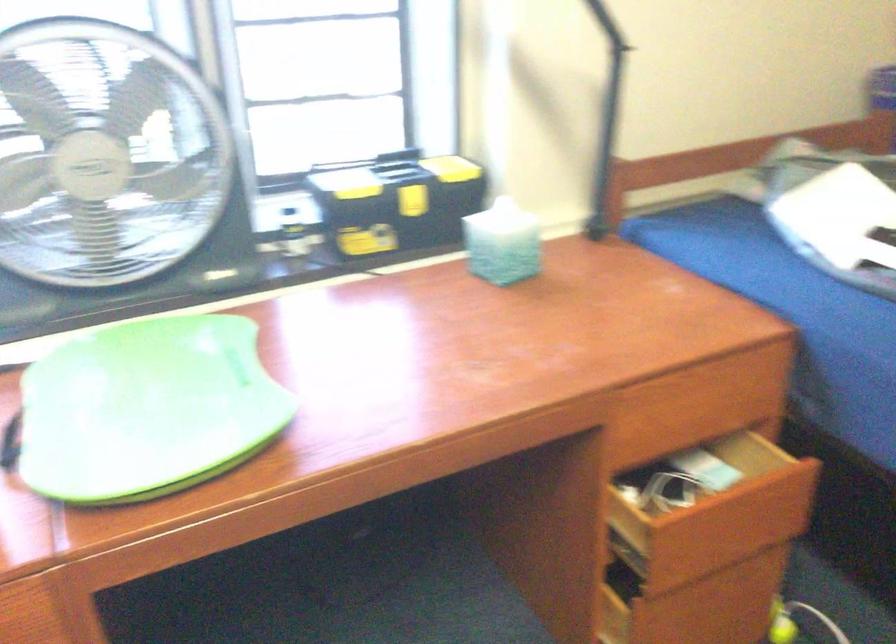
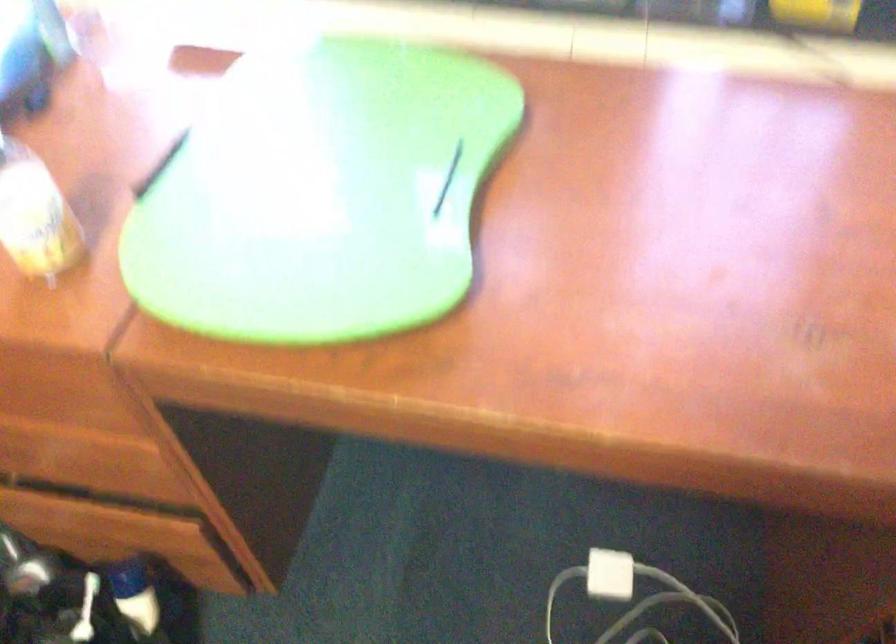
The first image is from the beginning of the video and the second image is from the end. How did the camera likely rotate when shooting the video?

The camera's rotation is toward left-down.